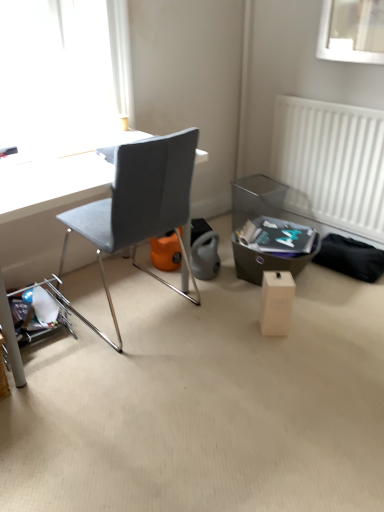
Question: Is white cardboard box at center facing away from matte gray chair at center?

Choices:
 (A) yes
 (B) no

Answer: (B)

Question: From the image's perspective, would you say white cardboard box at center is positioned over matte gray chair at center?

Choices:
 (A) no
 (B) yes

Answer: (A)

Question: Is white cardboard box at center oriented towards matte gray chair at center?

Choices:
 (A) yes
 (B) no

Answer: (B)

Question: Are white cardboard box at center and matte gray chair at center located far from each other?

Choices:
 (A) yes
 (B) no

Answer: (B)

Question: Is white cardboard box at center at the right side of matte gray chair at center?

Choices:
 (A) no
 (B) yes

Answer: (B)

Question: From the image's perspective, is white cardboard box at center located beneath matte gray chair at center?

Choices:
 (A) yes
 (B) no

Answer: (A)

Question: Can you confirm if white cardboard box at center is smaller than white plastic radiator at right?

Choices:
 (A) no
 (B) yes

Answer: (B)

Question: Can you confirm if white cardboard box at center is thinner than white plastic radiator at right?

Choices:
 (A) no
 (B) yes

Answer: (A)

Question: From the image's perspective, would you say white cardboard box at center is positioned over white plastic radiator at right?

Choices:
 (A) yes
 (B) no

Answer: (B)

Question: Is white cardboard box at center taller than white plastic radiator at right?

Choices:
 (A) yes
 (B) no

Answer: (B)

Question: From the image's perspective, is white cardboard box at center under white plastic radiator at right?

Choices:
 (A) yes
 (B) no

Answer: (A)

Question: Would you consider white cardboard box at center to be distant from white plastic radiator at right?

Choices:
 (A) yes
 (B) no

Answer: (B)

Question: Is white plastic radiator at right positioned behind white cardboard box at center?

Choices:
 (A) no
 (B) yes

Answer: (B)